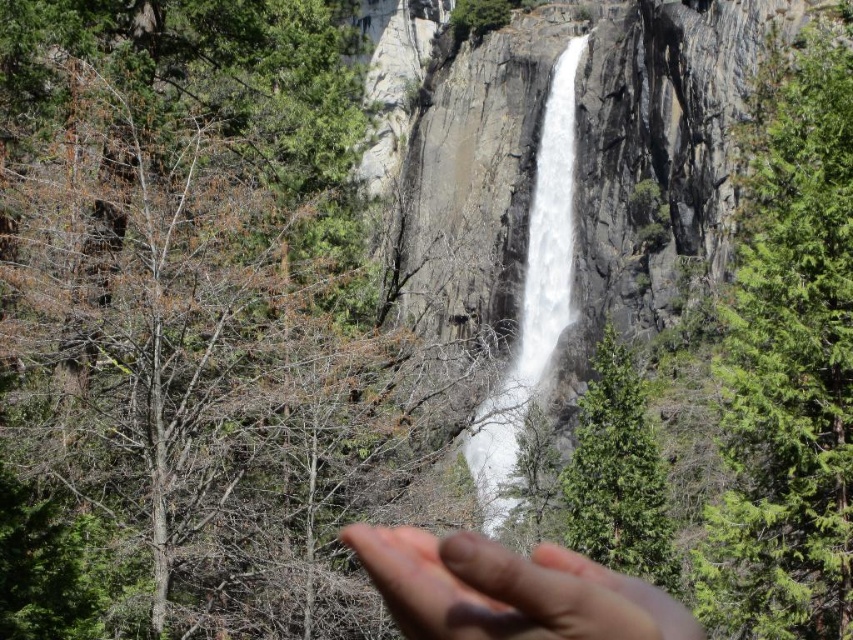
Does skinny flesh at center appear on the right side of white frothy water at center?

No, skinny flesh at center is not to the right of white frothy water at center.

What do you see at coordinates (508, 589) in the screenshot? The height and width of the screenshot is (640, 853). I see `skinny flesh at center` at bounding box center [508, 589].

This screenshot has height=640, width=853. I want to click on skinny flesh at center, so click(508, 589).